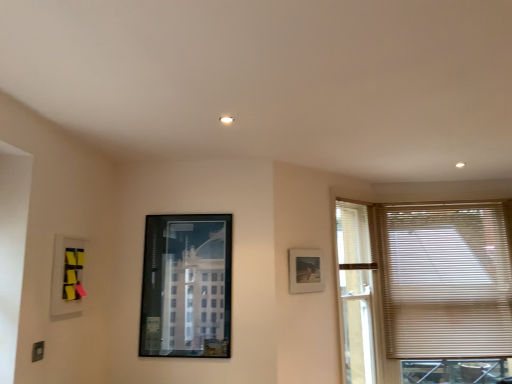
Question: Considering the relative positions of matte plastic picture frame at upper left, positioned as the 1th picture frame in front-to-back order, and matte black picture frame at upper right, marked as the 3th picture frame in a front-to-back arrangement, in the image provided, is matte plastic picture frame at upper left, positioned as the 1th picture frame in front-to-back order, to the left or to the right of matte black picture frame at upper right, marked as the 3th picture frame in a front-to-back arrangement,?

Choices:
 (A) right
 (B) left

Answer: (B)

Question: In the image, is matte plastic picture frame at upper left, the 1th picture frame from the left, positioned in front of or behind matte black picture frame at upper right, which is the third picture frame from left to right?

Choices:
 (A) behind
 (B) front

Answer: (B)

Question: Estimate the real-world distances between objects in this image. Which object is closer to the matte plastic picture frame at upper left, the 3th picture frame in the back-to-front sequence?

Choices:
 (A) beige blinds at right
 (B) matte black picture frame at upper right, which ranks as the first picture frame in right-to-left order
 (C) metallic glass picture frame at center, positioned as the 2th picture frame in left-to-right order

Answer: (C)

Question: Which object is the closest to the metallic glass picture frame at center, positioned as the 2th picture frame in left-to-right order?

Choices:
 (A) matte plastic picture frame at upper left, positioned as the 1th picture frame in front-to-back order
 (B) beige blinds at right
 (C) matte black picture frame at upper right, which is the third picture frame from left to right

Answer: (A)